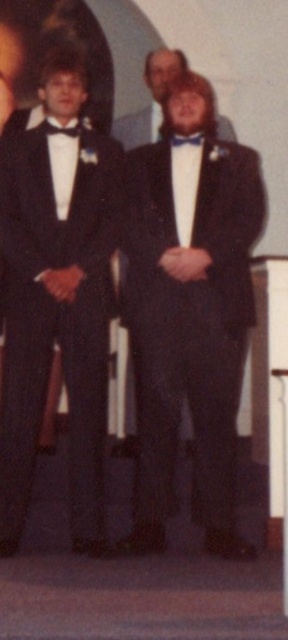
Which is below, matte black tuxedo at left or matte black suit at center?

matte black tuxedo at left is below.

You are a GUI agent. You are given a task and a screenshot of the screen. Output one action in this format:
    pyautogui.click(x=<x>, y=<y>)
    Task: Click on the matte black tuxedo at left
    
    Given the screenshot: What is the action you would take?
    pyautogui.click(x=57, y=292)

Image resolution: width=288 pixels, height=640 pixels. What are the coordinates of `matte black tuxedo at left` in the screenshot? It's located at 57,292.

Image resolution: width=288 pixels, height=640 pixels. What are the coordinates of `matte black tuxedo at left` in the screenshot? It's located at (57, 292).

Is point (137, 118) positioned in front of point (199, 138)?

That is False.

Which of these two, matte black suit at center or blue satin bow tie at center, stands shorter?

Standing shorter between the two is blue satin bow tie at center.

The image size is (288, 640). What do you see at coordinates (152, 97) in the screenshot?
I see `matte black suit at center` at bounding box center [152, 97].

At what (x,y) coordinates should I click in order to perform the action: click on matte black suit at center. Please return your answer as a coordinate pair (x, y). The width and height of the screenshot is (288, 640). Looking at the image, I should click on (152, 97).

Does matte black tuxedo at left have a greater height compared to blue satin bow tie at center?

Indeed, matte black tuxedo at left has a greater height compared to blue satin bow tie at center.

Is the position of matte black tuxedo at left more distant than that of blue satin bow tie at center?

No, matte black tuxedo at left is closer to the viewer.

This screenshot has width=288, height=640. Describe the element at coordinates (57, 292) in the screenshot. I see `matte black tuxedo at left` at that location.

You are a GUI agent. You are given a task and a screenshot of the screen. Output one action in this format:
    pyautogui.click(x=<x>, y=<y>)
    Task: Click on the matte black tuxedo at left
    This screenshot has width=288, height=640.
    Given the screenshot: What is the action you would take?
    pyautogui.click(x=57, y=292)